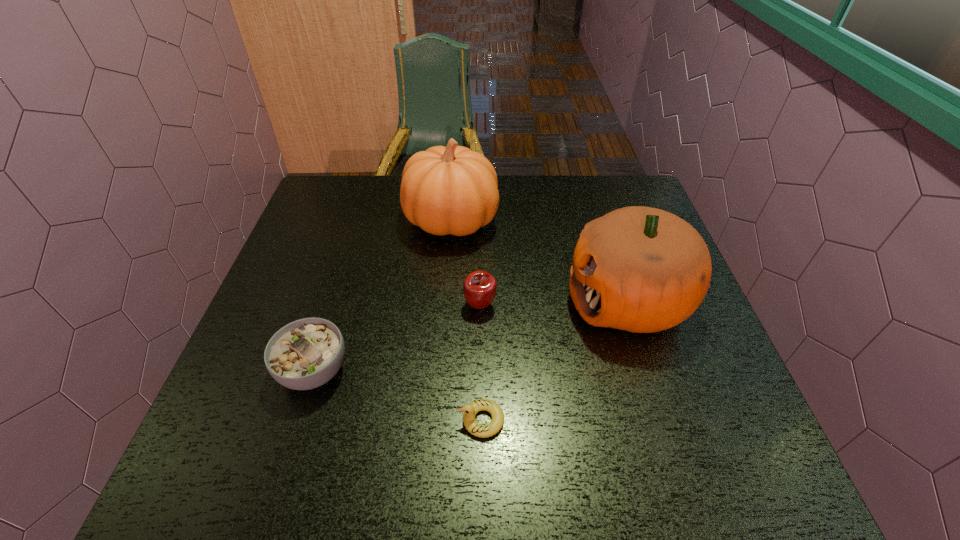
Find the location of a particular element. The height and width of the screenshot is (540, 960). free space that is in between the rightmost object and the leftmost object is located at coordinates (470, 335).

Find the location of a particular element. This screenshot has height=540, width=960. blank region between the apple and the right pumpkin is located at coordinates (554, 302).

Where is `free point between the left pumpkin and the duckling`? free point between the left pumpkin and the duckling is located at coordinates (467, 320).

Find the location of a particular element. vacant region between the left pumpkin and the duckling is located at coordinates (467, 320).

Image resolution: width=960 pixels, height=540 pixels. What are the coordinates of `free point between the soup bowl and the apple` in the screenshot? It's located at (397, 338).

Image resolution: width=960 pixels, height=540 pixels. Identify the location of empty space between the nearer pumpkin and the duckling. (555, 360).

Choose which object is the third nearest neighbor to the rightmost object. Please provide its 2D coordinates. Your answer should be formatted as a tuple, i.e. [(x, y)], where the tuple contains the x and y coordinates of a point satisfying the conditions above.

[(470, 410)]

At what (x,y) coordinates should I click in order to perform the action: click on the third closest object relative to the apple. Please return your answer as a coordinate pair (x, y). Looking at the image, I should click on (470, 410).

Find the location of a particular element. The width and height of the screenshot is (960, 540). free point that satisfies the following two spatial constraints: 1. on the back side of the soup bowl; 2. on the left side of the apple is located at coordinates (335, 305).